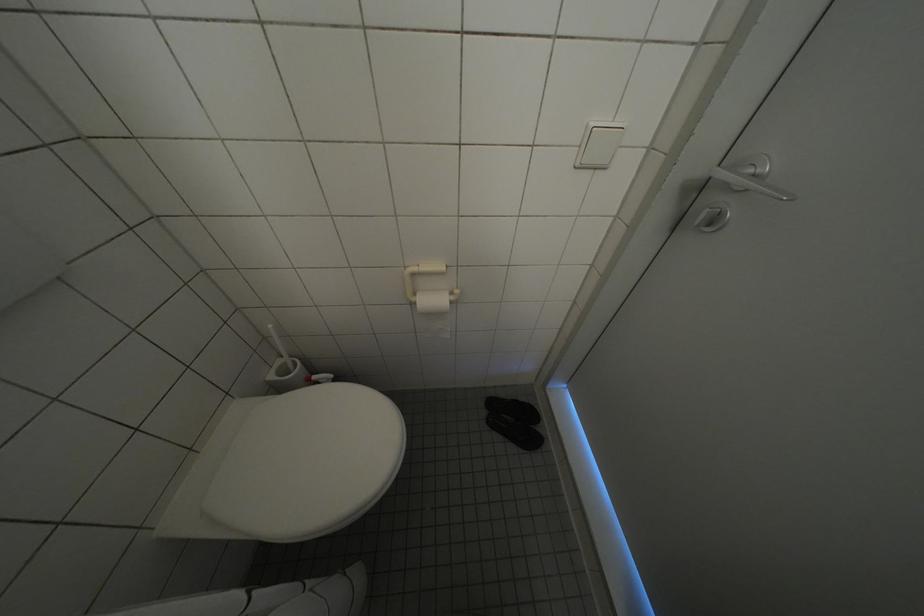
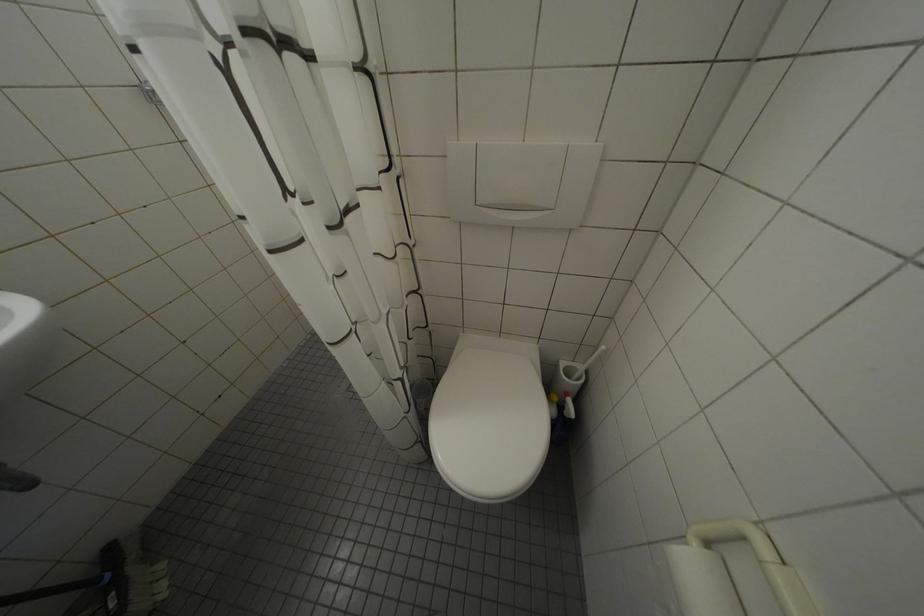
Based on the photo, first-person continuous shooting, in which direction is the camera rotating?

The rotation direction of the camera is left-down.